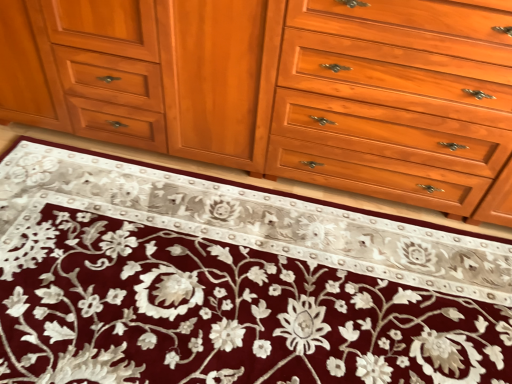
Find the location of a particular element. light brown wood drawer at center is located at coordinates (396, 101).

Locate an element on the screen. The height and width of the screenshot is (384, 512). maroon velvet rug at center is located at coordinates (233, 283).

You are a GUI agent. You are given a task and a screenshot of the screen. Output one action in this format:
    pyautogui.click(x=<x>, y=<y>)
    Task: Click on the matte wood cabinet at center
    The height and width of the screenshot is (384, 512).
    Given the screenshot: What is the action you would take?
    pyautogui.click(x=137, y=72)

Is maroon velvet rug at center completely or partially outside of light brown wood drawer at center?

Yes, maroon velvet rug at center is not within light brown wood drawer at center.

Between maroon velvet rug at center and light brown wood drawer at center, which one has larger width?

Wider between the two is maroon velvet rug at center.

Is maroon velvet rug at center aimed at light brown wood drawer at center?

No, maroon velvet rug at center is not oriented towards light brown wood drawer at center.

From the picture: From a real-world perspective, is matte wood cabinet at center physically above maroon velvet rug at center?

Correct, in the physical world, matte wood cabinet at center is higher than maroon velvet rug at center.

Is matte wood cabinet at center turned away from maroon velvet rug at center?

No, matte wood cabinet at center is not facing the opposite direction of maroon velvet rug at center.

Would you say matte wood cabinet at center is outside maroon velvet rug at center?

That's correct, matte wood cabinet at center is outside of maroon velvet rug at center.

You are a GUI agent. You are given a task and a screenshot of the screen. Output one action in this format:
    pyautogui.click(x=<x>, y=<y>)
    Task: Click on the cabinetry that is above the maroon velvet rug at center (from a real-world perspective)
    
    Given the screenshot: What is the action you would take?
    pyautogui.click(x=137, y=72)

Locate an element on the screen. doormat that is in front of the light brown wood drawer at center is located at coordinates (233, 283).

Between light brown wood drawer at center and maroon velvet rug at center, which one has smaller width?

light brown wood drawer at center is thinner.

Can you confirm if light brown wood drawer at center is positioned to the right of maroon velvet rug at center?

Yes, light brown wood drawer at center is to the right of maroon velvet rug at center.

Is light brown wood drawer at center oriented away from maroon velvet rug at center?

light brown wood drawer at center does not have its back to maroon velvet rug at center.

From a real-world perspective, is matte wood cabinet at center positioned above or below light brown wood drawer at center?

From a real-world perspective, matte wood cabinet at center is physically below light brown wood drawer at center.

Is light brown wood drawer at center at the back of matte wood cabinet at center?

No, matte wood cabinet at center's orientation is not away from light brown wood drawer at center.

Measure the distance between matte wood cabinet at center and light brown wood drawer at center.

matte wood cabinet at center and light brown wood drawer at center are 20.78 inches apart from each other.

Is maroon velvet rug at center outside of matte wood cabinet at center?

Yes.

From the image's perspective, relative to matte wood cabinet at center, is maroon velvet rug at center above or below?

maroon velvet rug at center is below matte wood cabinet at center.

Identify the location of drawer lying in front of the matte wood cabinet at center. [396, 101].

Between light brown wood drawer at center and matte wood cabinet at center, which one has smaller width?

matte wood cabinet at center.

Which is correct: light brown wood drawer at center is inside matte wood cabinet at center, or outside of it?

The correct answer is: outside.

Is light brown wood drawer at center aimed at matte wood cabinet at center?

No, light brown wood drawer at center is not oriented towards matte wood cabinet at center.

Identify the location of drawer located above the maroon velvet rug at center (from the image's perspective). (396, 101).

This screenshot has height=384, width=512. Identify the location of doormat that is under the matte wood cabinet at center (from a real-world perspective). (233, 283).

Considering their positions, is maroon velvet rug at center positioned further to light brown wood drawer at center than matte wood cabinet at center?

maroon velvet rug at center lies further to light brown wood drawer at center than the other object.

Based on their spatial positions, is light brown wood drawer at center or maroon velvet rug at center further from matte wood cabinet at center?

maroon velvet rug at center is further to matte wood cabinet at center.

Looking at the image, which one is located further to maroon velvet rug at center, light brown wood drawer at center or matte wood cabinet at center?

Based on the image, matte wood cabinet at center appears to be further to maroon velvet rug at center.

When comparing their distances from light brown wood drawer at center, does matte wood cabinet at center or maroon velvet rug at center seem closer?

Based on the image, matte wood cabinet at center appears to be nearer to light brown wood drawer at center.

When comparing their distances from matte wood cabinet at center, does maroon velvet rug at center or light brown wood drawer at center seem closer?

Among the two, light brown wood drawer at center is located nearer to matte wood cabinet at center.

Looking at the image, which one is located further to maroon velvet rug at center, matte wood cabinet at center or light brown wood drawer at center?

matte wood cabinet at center lies further to maroon velvet rug at center than the other object.

Where is `doormat between matte wood cabinet at center and light brown wood drawer at center in the horizontal direction`? doormat between matte wood cabinet at center and light brown wood drawer at center in the horizontal direction is located at coordinates coord(233,283).